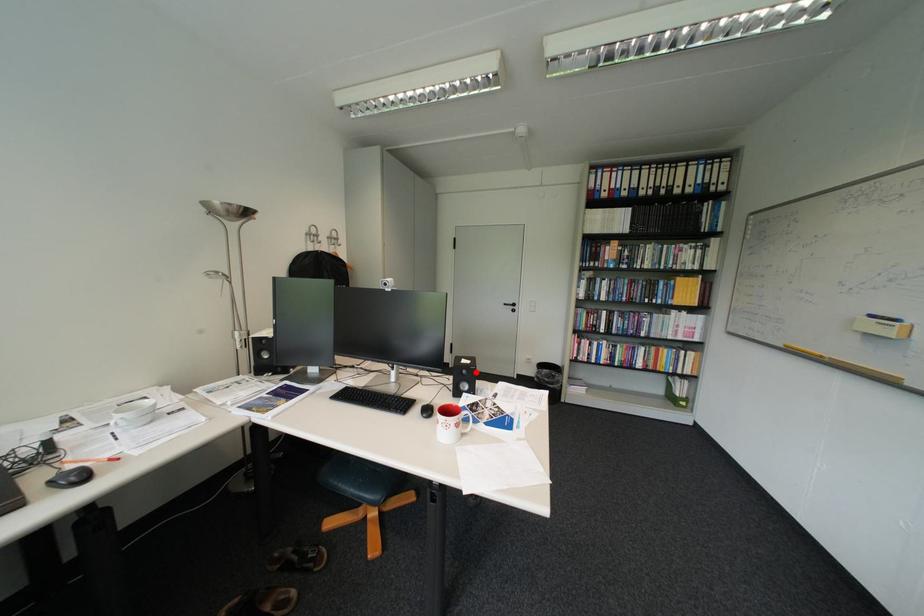
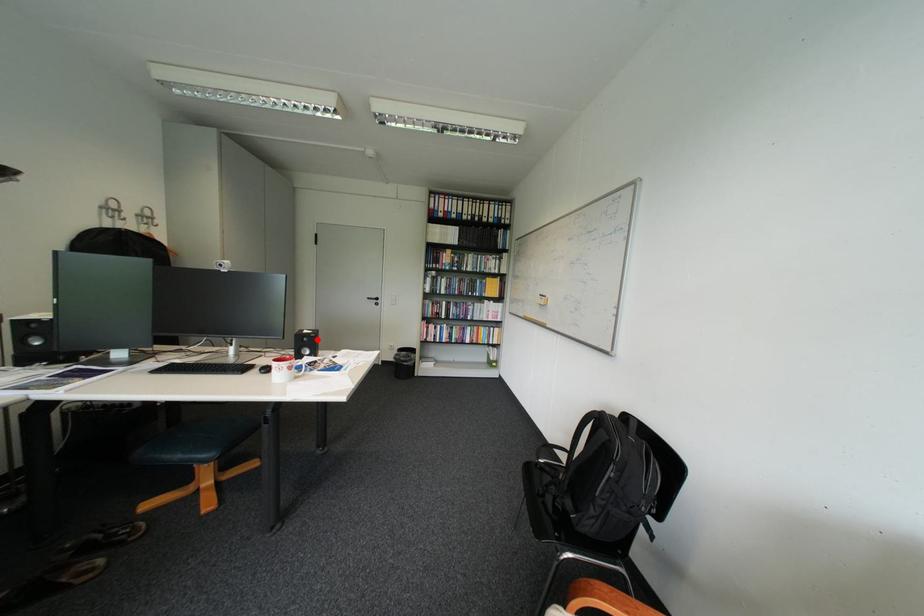
I am providing you with two images of the same scene from different viewpoints. A red point is marked on the first image and another point is marked on the second image. Does the point marked in image1 correspond to the same location as the one in image2?

Yes